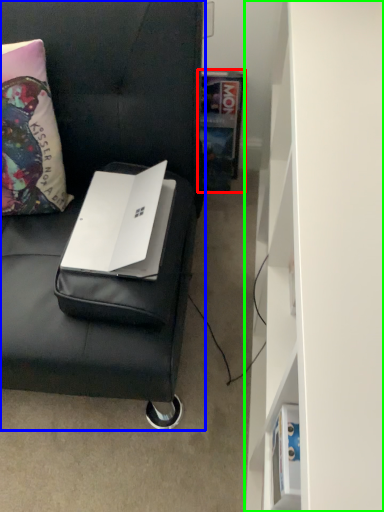
Question: Considering the real-world distances, which object is closest to book (highlighted by a red box)? furniture (highlighted by a blue box) or bookshelf (highlighted by a green box).

Choices:
 (A) furniture
 (B) bookshelf

Answer: (A)